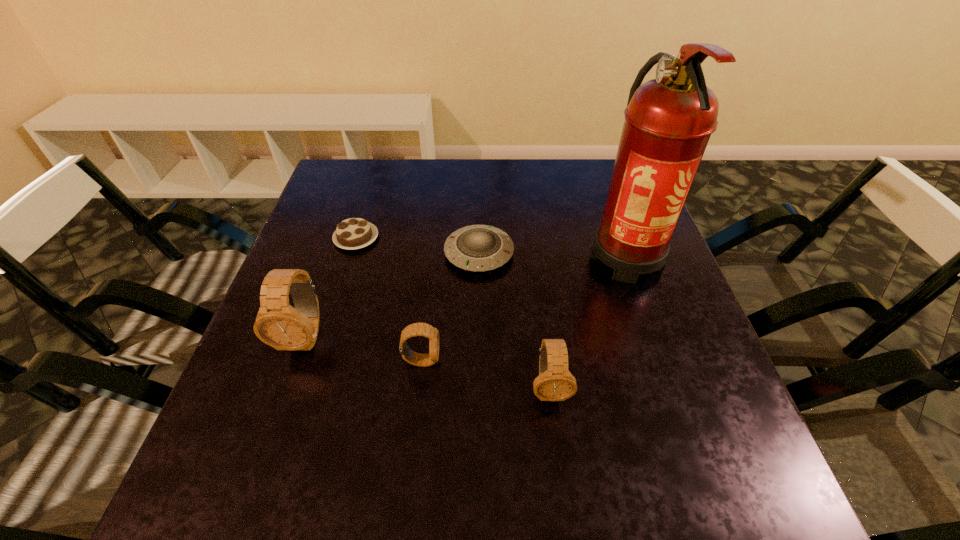
At what (x,y) coordinates should I click in order to perform the action: click on vacant space that satisfies the following two spatial constraints: 1. on the front side of the second shortest object; 2. on the face of the second watch from right to left. Please return your answer as a coordinate pair (x, y). This screenshot has width=960, height=540. Looking at the image, I should click on (479, 361).